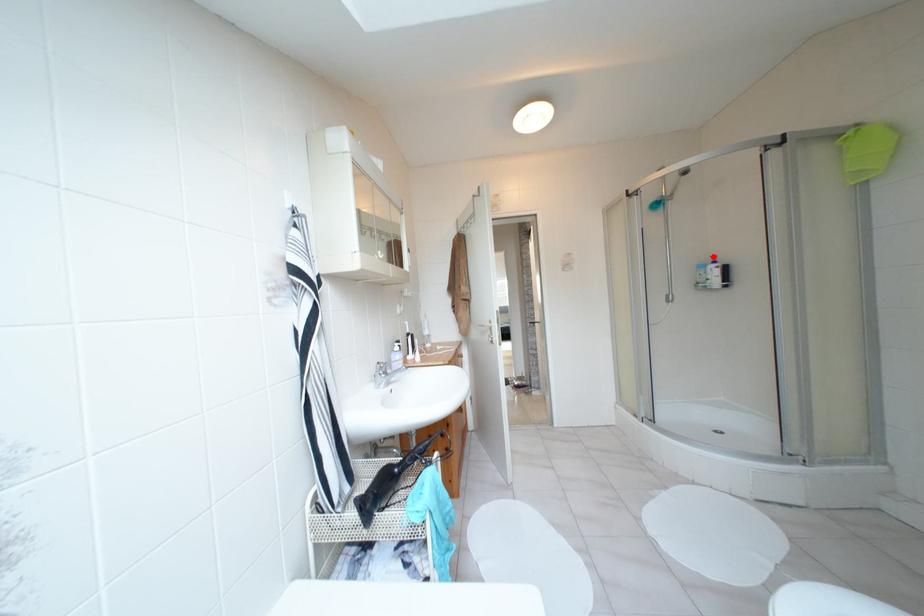
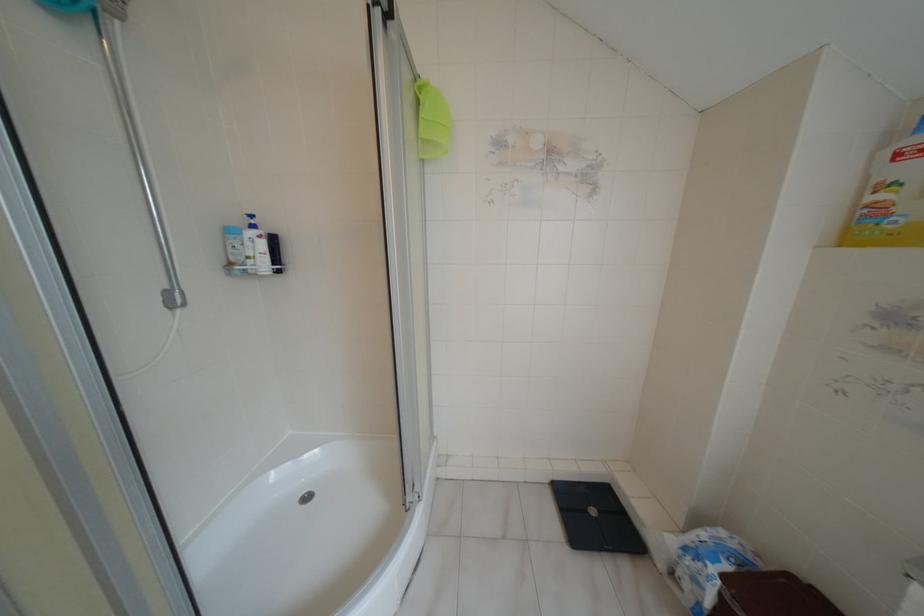
In the second image, find the point that corresponds to the highlighted location in the first image.

(251, 216)